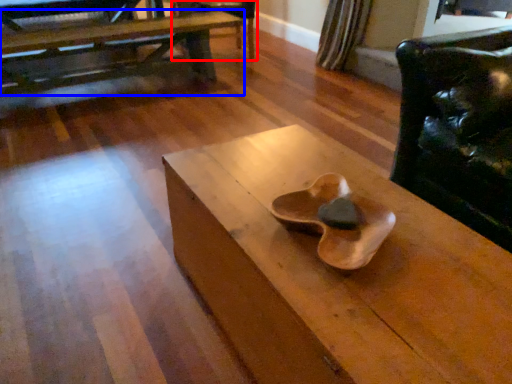
Question: Which of the following is the farthest to the observer, armchair (highlighted by a red box) or table (highlighted by a blue box)?

Choices:
 (A) armchair
 (B) table

Answer: (A)